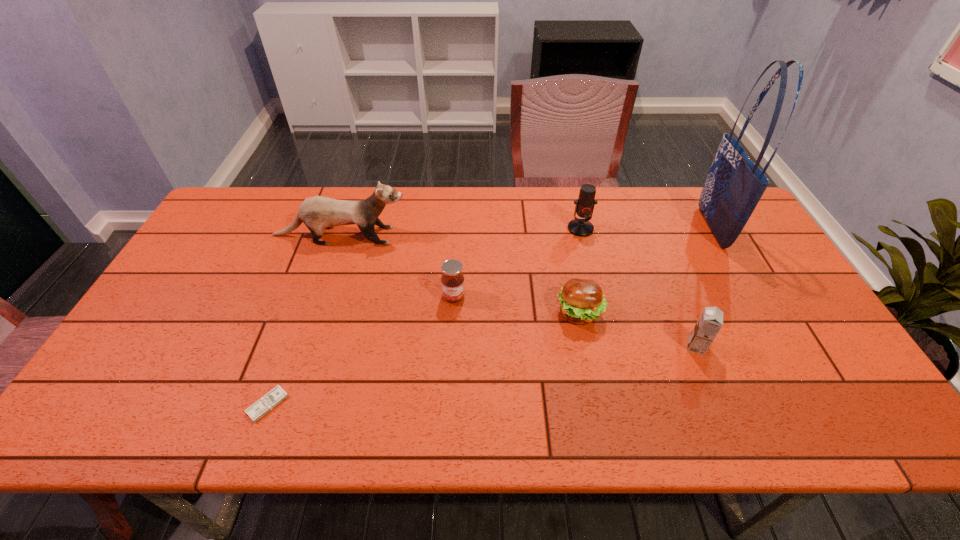
The image size is (960, 540). In order to click on ferret present at the far edge in this screenshot , I will do `click(317, 213)`.

Locate an element on the screen. Image resolution: width=960 pixels, height=540 pixels. microphone that is positioned at the far edge is located at coordinates (585, 203).

Locate an element on the screen. This screenshot has height=540, width=960. object that is positioned at the near edge is located at coordinates (265, 404).

Find the location of a particular element. The width and height of the screenshot is (960, 540). object present at the right edge is located at coordinates (734, 186).

The image size is (960, 540). What are the coordinates of `object located at the far right corner` in the screenshot? It's located at click(734, 186).

The width and height of the screenshot is (960, 540). I want to click on vacant area at the far edge, so click(x=511, y=202).

Where is `blank space at the near edge of the desktop`? Image resolution: width=960 pixels, height=540 pixels. blank space at the near edge of the desktop is located at coordinates (708, 429).

Where is `vacant region at the left edge of the desktop`? vacant region at the left edge of the desktop is located at coordinates (179, 343).

You are a GUI agent. You are given a task and a screenshot of the screen. Output one action in this format:
    pyautogui.click(x=<x>, y=<y>)
    Task: Click on the vacant position at the near left corner of the desktop
    
    Given the screenshot: What is the action you would take?
    pyautogui.click(x=125, y=428)

I want to click on free location at the near right corner, so click(819, 430).